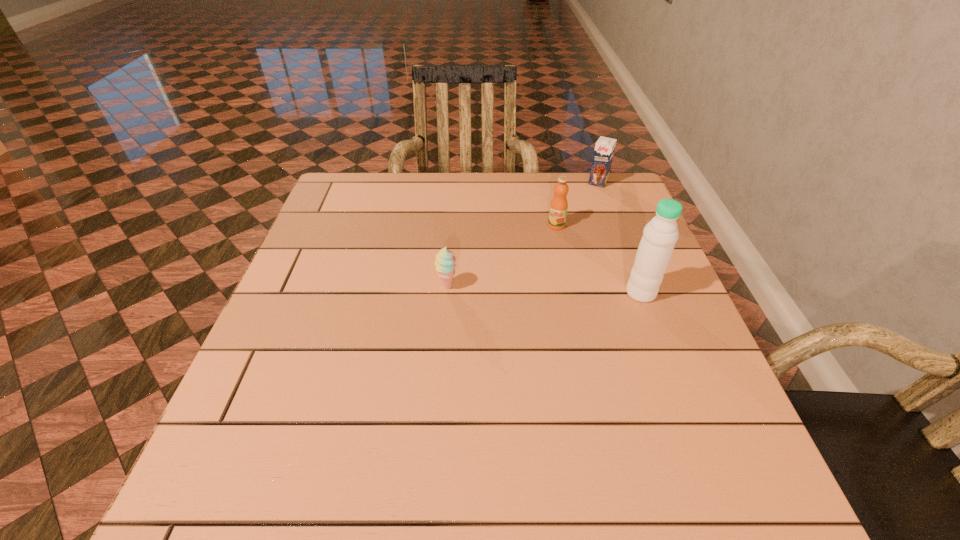
Identify the location of vacant area that lies between the shortest object and the water bottle. (544, 289).

Find the location of a particular element. The width and height of the screenshot is (960, 540). free space between the third nearest object and the leftmost object is located at coordinates 501,255.

Where is `free spot between the tallest object and the leftmost object`? The image size is (960, 540). free spot between the tallest object and the leftmost object is located at coordinates (544, 289).

Find the location of `free space between the farthest object and the shortest object`. free space between the farthest object and the shortest object is located at coordinates (522, 234).

What are the coordinates of `free space between the tallest object and the leftmost object` in the screenshot? It's located at (544, 289).

At what (x,y) coordinates should I click in order to perform the action: click on object that ranks as the second closest to the orange juice. Please return your answer as a coordinate pair (x, y). Looking at the image, I should click on [659, 237].

Find the location of a particular element. object that is the third nearest to the orange juice is located at coordinates (445, 264).

At what (x,y) coordinates should I click in order to perform the action: click on blank area in the image that satisfies the following two spatial constraints: 1. on the front side of the third object from right to left; 2. on the left side of the tallest object. Please return your answer as a coordinate pair (x, y). Looking at the image, I should click on (570, 293).